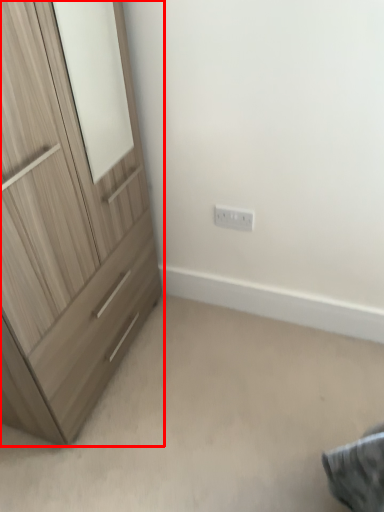
Question: Where is chest of drawers (annotated by the red box) located in relation to electric outlet in the image?

Choices:
 (A) right
 (B) left

Answer: (B)